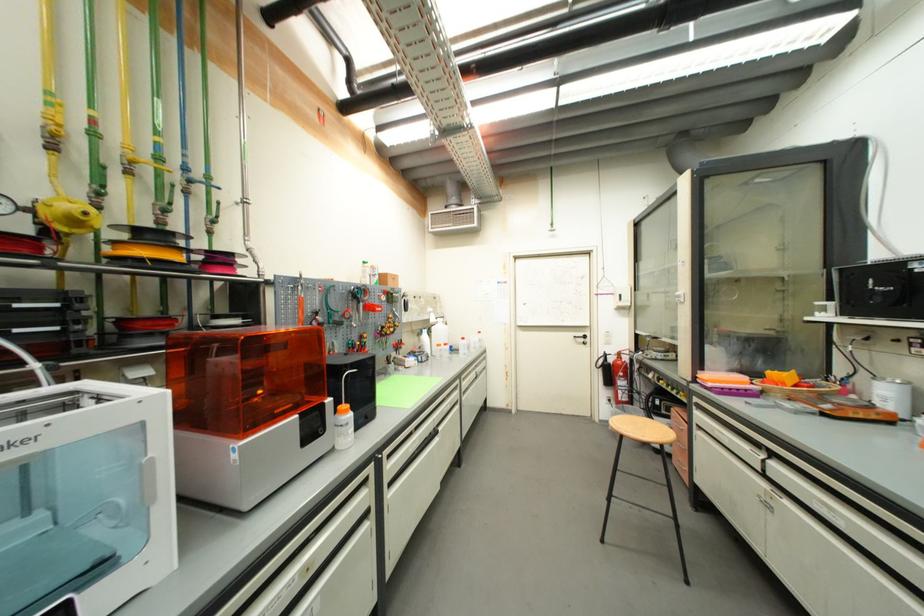
Describe the element at coordinates (251, 357) in the screenshot. This screenshot has height=616, width=924. I see `a orange printer cover` at that location.